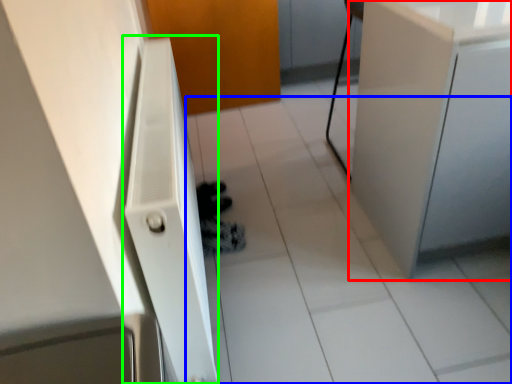
Question: Which object is positioned closest to cabinetry (highlighted by a red box)? Select from tile (highlighted by a blue box) and radiator (highlighted by a green box).

Choices:
 (A) tile
 (B) radiator

Answer: (A)